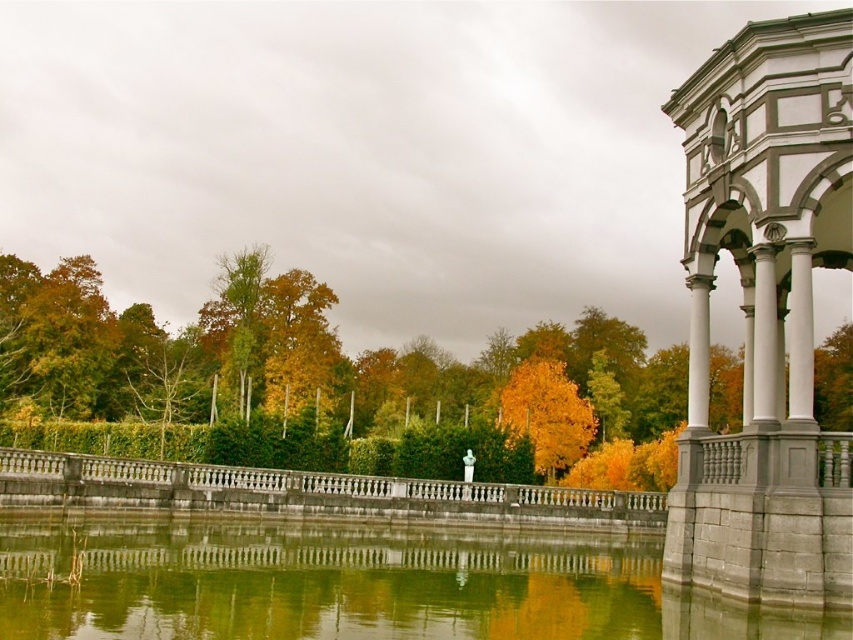
You are standing at the edge of the pond and want to place a small decorative stone at point (291,380). According to the scene description, where exactly should you place the stone?

You should place the small decorative stone on the yellow green leaves at center because the point (291,380) is located there.

You are standing at the edge of the pond in the image. There is a point marked at coordinates (291,380). What object does this point correspond to?

The point corresponds to yellow green leaves at center.